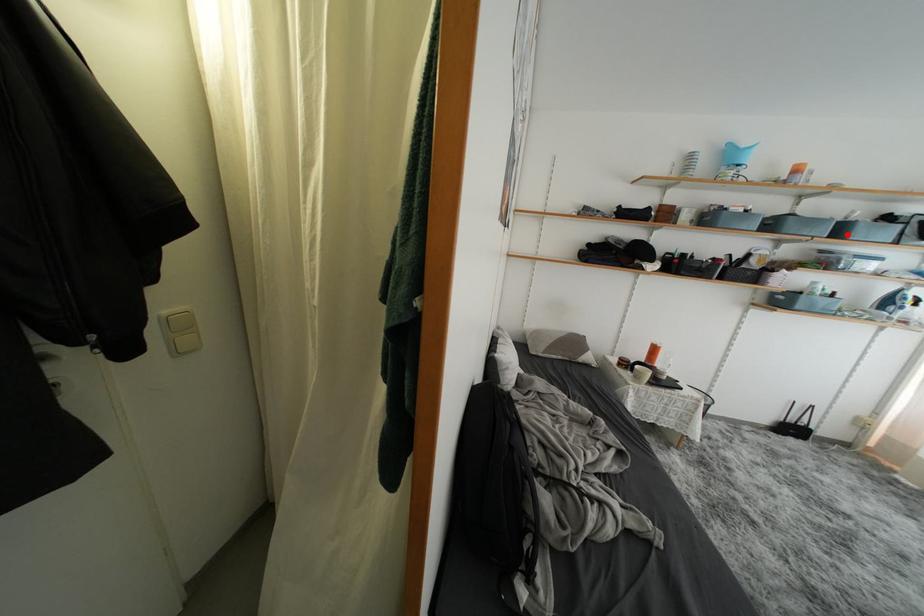
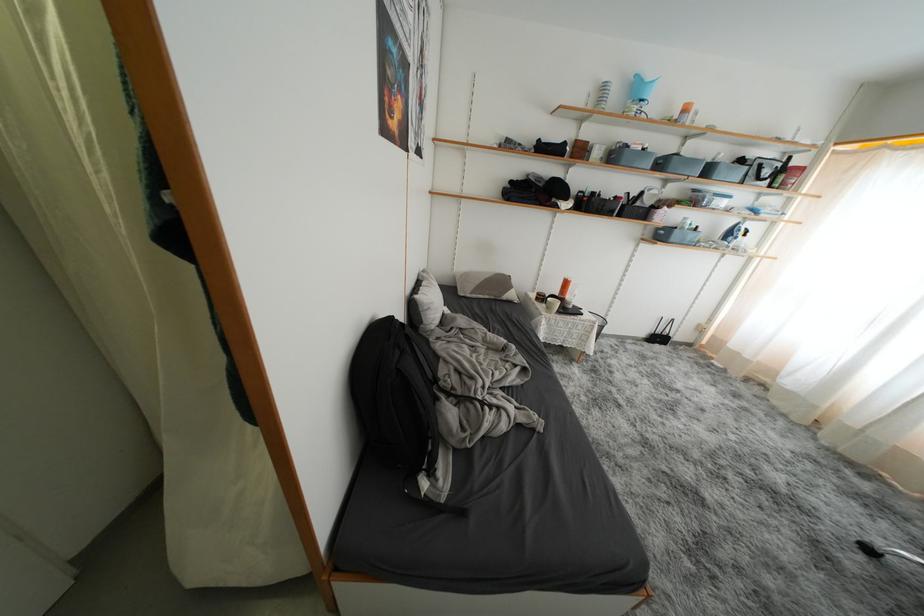
Where in the second image is the point corresponding to the highlighted location from the first image?

(714, 175)